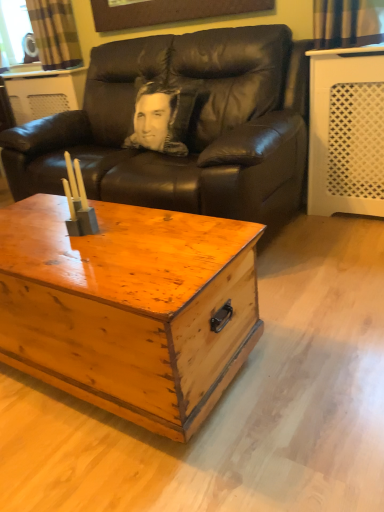
Identify the location of empty space that is to the right of wooden chest at center. (308, 339).